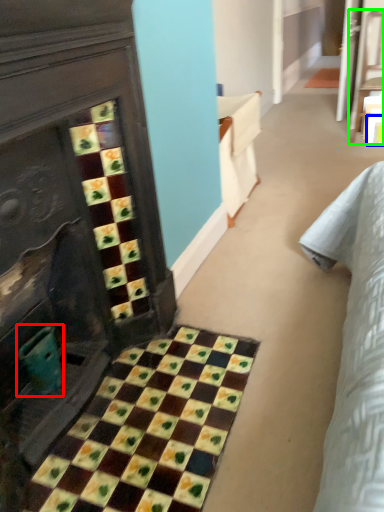
Question: Considering the real-world distances, which object is closest to teal (highlighted by a red box)? square (highlighted by a blue box) or furniture (highlighted by a green box).

Choices:
 (A) square
 (B) furniture

Answer: (A)